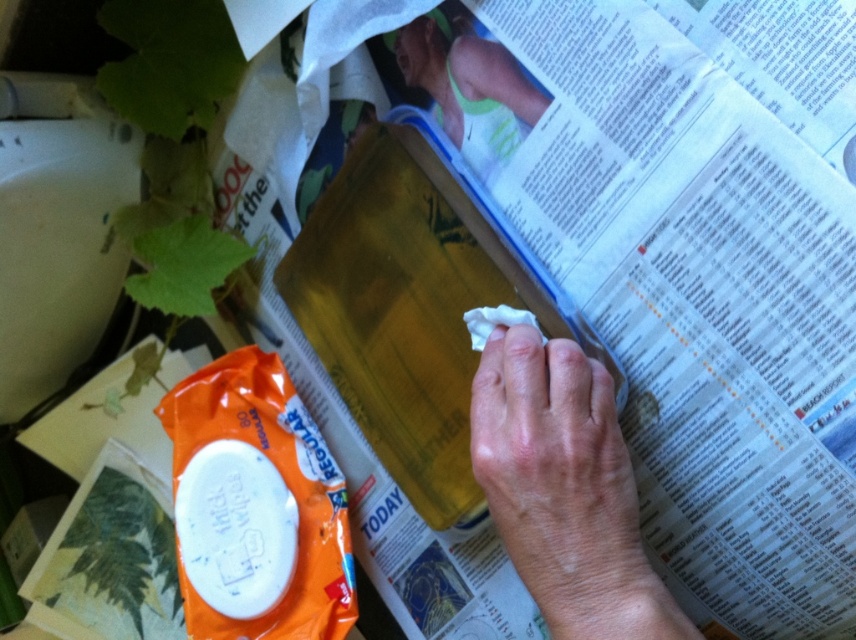
Between point (584, 362) and point (508, 61), which one is positioned in front?

Point (584, 362) is in front.

Is dry skin at center positioned in front of skinny green tank top at upper center?

Yes, it is.

Which is behind, point (607, 424) or point (452, 106)?

The point (452, 106) is behind.

The image size is (856, 640). In order to click on dry skin at center in this screenshot , I will do `click(565, 490)`.